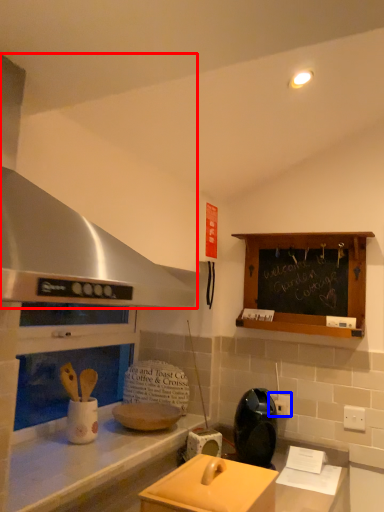
Question: Which point is closer to the camera, exhaust hood (highlighted by a red box) or electric outlet (highlighted by a blue box)?

Choices:
 (A) exhaust hood
 (B) electric outlet

Answer: (A)